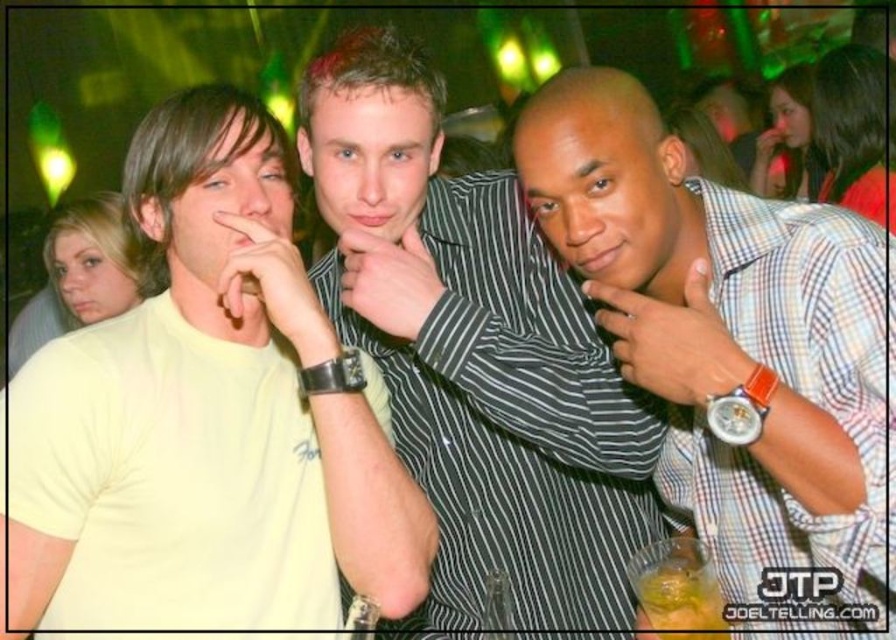
Which of these two, yellow matte t-shirt at left or plaid shirt at center, stands shorter?

plaid shirt at center

Does yellow matte t-shirt at left come in front of plaid shirt at center?

No, yellow matte t-shirt at left is further to the viewer.

The height and width of the screenshot is (640, 896). I want to click on yellow matte t-shirt at left, so click(208, 417).

The width and height of the screenshot is (896, 640). Describe the element at coordinates (208, 417) in the screenshot. I see `yellow matte t-shirt at left` at that location.

Between point (418, 518) and point (360, 186), which one is positioned behind?

The point (360, 186) is behind.

Between point (369, 576) and point (526, 387), which one is positioned behind?

The point (526, 387) is more distant.

What are the coordinates of `yellow matte t-shirt at left` in the screenshot? It's located at (208, 417).

Which is more to the right, yellow matte t-shirt at left or translucent plastic cup at center?

translucent plastic cup at center

Image resolution: width=896 pixels, height=640 pixels. What do you see at coordinates (208, 417) in the screenshot?
I see `yellow matte t-shirt at left` at bounding box center [208, 417].

I want to click on yellow matte t-shirt at left, so click(208, 417).